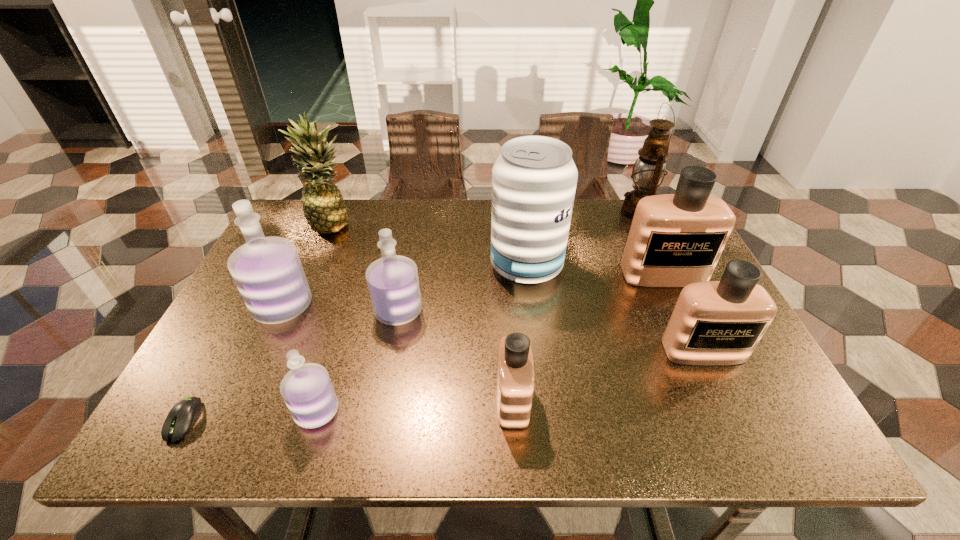
The width and height of the screenshot is (960, 540). I want to click on the third perfume from right to left, so click(515, 369).

The height and width of the screenshot is (540, 960). What are the coordinates of `the leftmost beige perfume` in the screenshot? It's located at (515, 369).

Find the location of `the second perfume from left to right`. the second perfume from left to right is located at coordinates (307, 390).

This screenshot has height=540, width=960. Identify the location of the fourth object from left to right. (307, 390).

Where is `computer mouse`? computer mouse is located at coordinates tap(184, 414).

Where is `the shortest object`? This screenshot has width=960, height=540. the shortest object is located at coordinates (184, 414).

You are a GUI agent. You are given a task and a screenshot of the screen. Output one action in this format:
    pyautogui.click(x=<x>, y=<y>)
    Task: Click on the free location located 0.280m on the left of the brown oil lamp
    The height and width of the screenshot is (540, 960).
    Given the screenshot: What is the action you would take?
    pyautogui.click(x=532, y=212)

At what (x,y) coordinates should I click in order to perform the action: click on vacant space located 0.250m on the right of the pineapple. Please return your answer as a coordinate pair (x, y). The image size is (960, 540). Looking at the image, I should click on (437, 224).

Where is `vacant space located on the front of the alcohol`? vacant space located on the front of the alcohol is located at coordinates (535, 337).

The height and width of the screenshot is (540, 960). Find the location of `vacant space located 0.240m on the right of the leftmost perfume`. vacant space located 0.240m on the right of the leftmost perfume is located at coordinates (409, 306).